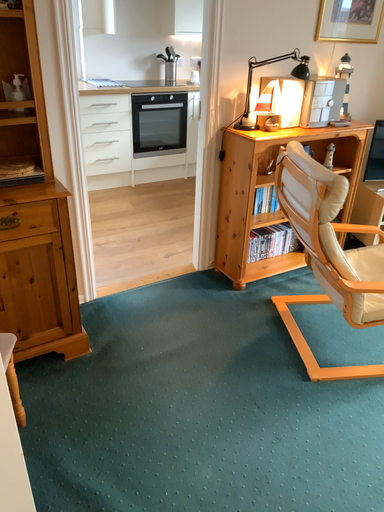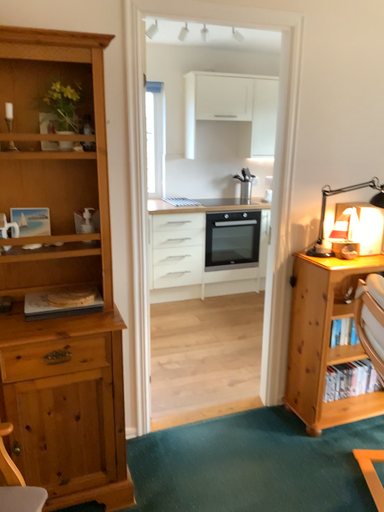
Question: Which way did the camera rotate in the video?

Choices:
 (A) rotated downward
 (B) rotated upward

Answer: (B)